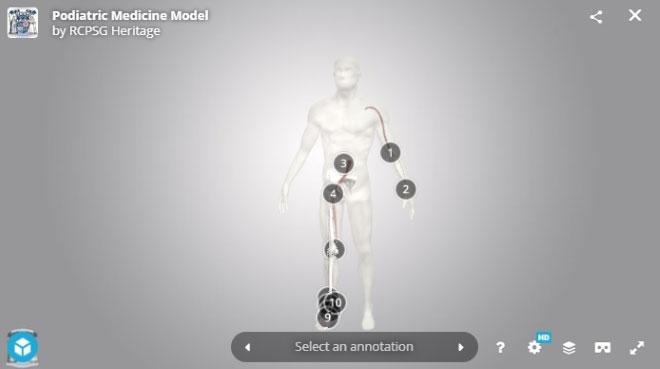
The width and height of the screenshot is (660, 369). I want to click on chest, so pyautogui.click(x=346, y=125).